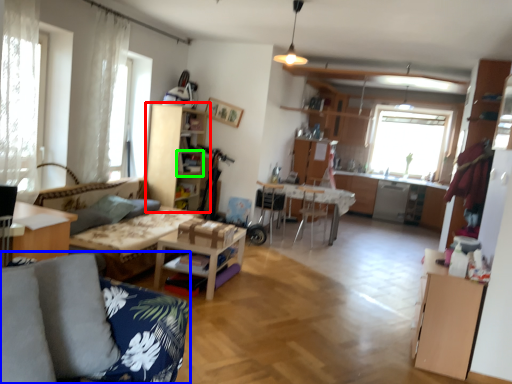
Question: Estimate the real-world distances between objects in this image. Which object is closer to cabinetry (highlighted by a red box), studio couch (highlighted by a blue box) or shelf (highlighted by a green box)?

Choices:
 (A) studio couch
 (B) shelf

Answer: (B)